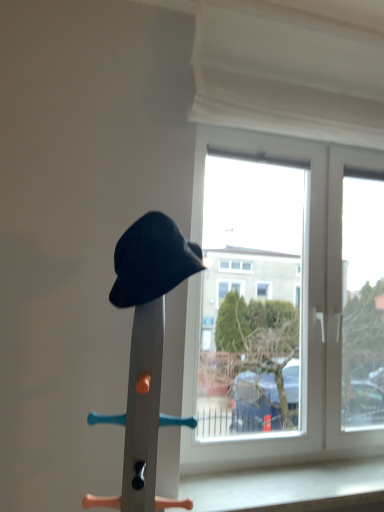
What is the approximate height of matte black hat at center?

matte black hat at center is 32.65 inches tall.

Describe the element at coordinates (152, 260) in the screenshot. I see `matte black hat at center` at that location.

Where is `matte black hat at center`? This screenshot has width=384, height=512. matte black hat at center is located at coordinates (146, 352).

Looking at this image, does matte black hat at center have a greater height compared to transparent glass window at center?

No.

Is matte black hat at center completely or partially outside of transparent glass window at center?

Yes.

From the image's perspective, is matte black hat at center located above transparent glass window at center?

Yes.

From a real-world perspective, between matte black hat at center and transparent glass window at center, who is vertically lower?

In real-world perspective, matte black hat at center is lower.

Based on their sizes in the image, would you say matte black hat at center is bigger or smaller than transparent glass window at center?

Answer: Considering their sizes, matte black hat at center takes up less space than transparent glass window at center.

In terms of height, does matte black hat at center look taller or shorter compared to transparent glass window at center?

In the image, matte black hat at center appears to be shorter than transparent glass window at center.

Can you confirm if matte black hat at center is wider than matte black hat at center?

In fact, matte black hat at center might be narrower than matte black hat at center.

You are a GUI agent. You are given a task and a screenshot of the screen. Output one action in this format:
    pyautogui.click(x=<x>, y=<y>)
    Task: Click on the hat that is above the matte black hat at center (from a real-world perspective)
    This screenshot has width=384, height=512.
    Given the screenshot: What is the action you would take?
    pyautogui.click(x=152, y=260)

Does matte black hat at center have a smaller size compared to matte black hat at center?

Indeed, matte black hat at center has a smaller size compared to matte black hat at center.

Is the position of white fabric curtain at upper center less distant than that of matte black hat at center?

No.

Does white fabric curtain at upper center have a larger size compared to matte black hat at center?

No.

From a real-world perspective, between white fabric curtain at upper center and matte black hat at center, who is vertically higher?

In real-world perspective, white fabric curtain at upper center is above.

Is matte black hat at center oriented away from matte black hat at center?

That's not correct — matte black hat at center is not looking away from matte black hat at center.

From the picture: Are matte black hat at center and matte black hat at center located far from each other?

matte black hat at center is near matte black hat at center, not far away.

Visually, is matte black hat at center positioned to the left or to the right of matte black hat at center?

In the image, matte black hat at center appears on the left side of matte black hat at center.

This screenshot has width=384, height=512. I want to click on hat behind the matte black hat at center, so click(152, 260).

Who is taller, transparent glass window at center or matte black hat at center?

transparent glass window at center is taller.

Does point (216, 442) come behind point (140, 301)?

Yes, point (216, 442) is behind point (140, 301).

From the image's perspective, is transparent glass window at center above or below matte black hat at center?

Based on their image positions, transparent glass window at center is located above matte black hat at center.

Which of these two, transparent glass window at center or matte black hat at center, is smaller?

Smaller between the two is matte black hat at center.

From the image's perspective, does white fabric curtain at upper center appear lower than matte black hat at center?

Actually, white fabric curtain at upper center appears above matte black hat at center in the image.

Are white fabric curtain at upper center and matte black hat at center far apart?

Actually, white fabric curtain at upper center and matte black hat at center are a little close together.

Between white fabric curtain at upper center and matte black hat at center, which one has larger size?

white fabric curtain at upper center is bigger.

Is white fabric curtain at upper center to the right of matte black hat at center from the viewer's perspective?

Yes.

This screenshot has width=384, height=512. What are the coordinates of `hat located above the transparent glass window at center (from the image's perspective)` in the screenshot? It's located at (152, 260).

You are a GUI agent. You are given a task and a screenshot of the screen. Output one action in this format:
    pyautogui.click(x=<x>, y=<y>)
    Task: Click on the window above the matte black hat at center (from a real-world perspective)
    This screenshot has height=512, width=384.
    Given the screenshot: What is the action you would take?
    pyautogui.click(x=303, y=310)

Estimate the real-world distances between objects in this image. Which object is further from matte black hat at center, white fabric curtain at upper center or matte black hat at center?

The object further to matte black hat at center is white fabric curtain at upper center.

From the picture: When comparing their distances from white fabric curtain at upper center, does matte black hat at center or matte black hat at center seem closer?

matte black hat at center is positioned closer to the anchor white fabric curtain at upper center.

From the image, which object appears to be nearer to matte black hat at center, transparent glass window at center or white fabric curtain at upper center?

transparent glass window at center is positioned closer to the anchor matte black hat at center.

From the picture: Looking at the image, which one is located further to transparent glass window at center, white fabric curtain at upper center or matte black hat at center?

matte black hat at center lies further to transparent glass window at center than the other object.

Looking at the image, which one is located further to transparent glass window at center, matte black hat at center or matte black hat at center?

Among the two, matte black hat at center is located further to transparent glass window at center.

Considering their positions, is matte black hat at center positioned closer to transparent glass window at center than white fabric curtain at upper center?

Among the two, white fabric curtain at upper center is located nearer to transparent glass window at center.

From the image, which object appears to be farther from matte black hat at center, matte black hat at center or white fabric curtain at upper center?

white fabric curtain at upper center lies further to matte black hat at center than the other object.

Which object lies further to the anchor point white fabric curtain at upper center, matte black hat at center or transparent glass window at center?

matte black hat at center is positioned further to the anchor white fabric curtain at upper center.

Identify the location of hat that lies between white fabric curtain at upper center and matte black hat at center from top to bottom. The height and width of the screenshot is (512, 384). (152, 260).

Locate an element on the screen. The image size is (384, 512). hat between white fabric curtain at upper center and transparent glass window at center vertically is located at coordinates (152, 260).

Identify the location of window between white fabric curtain at upper center and matte black hat at center vertically. (303, 310).

This screenshot has height=512, width=384. I want to click on hat located between matte black hat at center and transparent glass window at center in the depth direction, so click(152, 260).